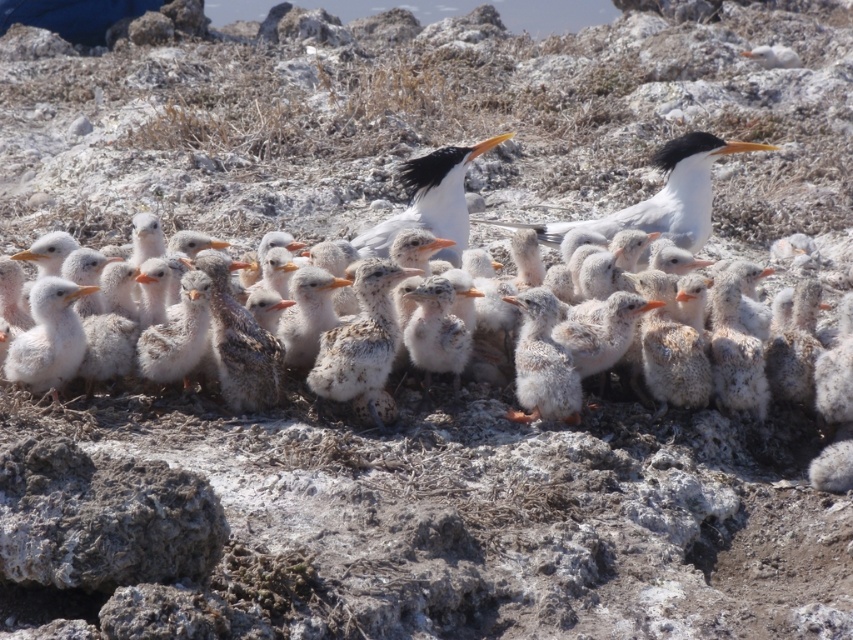
You are a photographer standing at the edge of the rocky terrain. You want to take a photo that includes both the point at (831, 445) and the point at (51, 292). Which point should you focus on first to ensure both are in sharp focus?

You should focus on the point at (51, 292) first because it is closer to you than the point at (831, 445), which is further away. This ensures the closer point is in focus, and the further point will also be within the depth of field.

You are a wildlife photographer aiming to capture a closeup shot of both the white fluffy bird at center and the white feathered bird at center. Given that your camera lens can only focus on objects within a 10cm width range, can you determine if both birds will fit within the focus range?

The white fluffy bird at center is wider than the white feathered bird at center. Since the camera lens can focus on objects within a 10cm width range, if the difference between their widths is less than or equal to 10cm, both can fit. However, the exact widths aren

You are a researcher observing the chicks in the coastal area. You notice a specific point marked at coordinates [664,195]. Which chick is located at this point?

The point at coordinates [664,195] marks the white glossy bird at upper center.